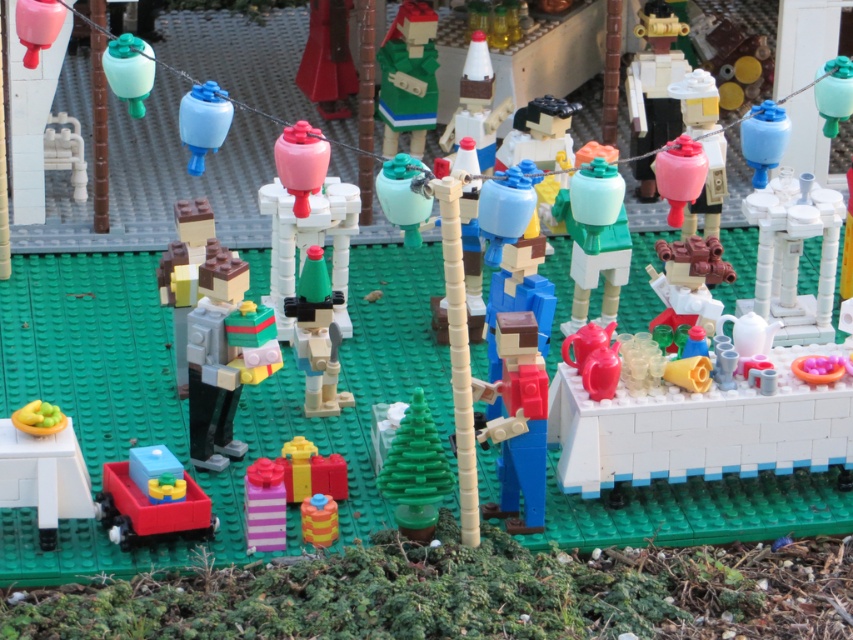
Looking at this image, which is above, matte pink vase at center or matte green plastic vase at center?

Positioned higher is matte green plastic vase at center.

Is matte pink vase at center positioned in front of matte green plastic vase at center?

That is False.

Locate an element on the screen. The image size is (853, 640). matte pink vase at center is located at coordinates (306, 218).

Does point (415, 58) come in front of point (851, 76)?

That is False.

Can you confirm if green matte figure at center is positioned above translucent teal vase at upper right?

Yes, green matte figure at center is above translucent teal vase at upper right.

What do you see at coordinates (408, 76) in the screenshot?
I see `green matte figure at center` at bounding box center [408, 76].

You are a GUI agent. You are given a task and a screenshot of the screen. Output one action in this format:
    pyautogui.click(x=<x>, y=<y>)
    Task: Click on the green matte figure at center
    This screenshot has height=640, width=853.
    Given the screenshot: What is the action you would take?
    pyautogui.click(x=408, y=76)

Which is in front, point (520, 392) or point (138, 67)?

Point (520, 392)

Is point (512, 396) more distant than point (132, 72)?

That is False.

You are a GUI agent. You are given a task and a screenshot of the screen. Output one action in this format:
    pyautogui.click(x=<x>, y=<y>)
    Task: Click on the smooth red block at center
    The image size is (853, 640).
    Given the screenshot: What is the action you would take?
    point(519,422)